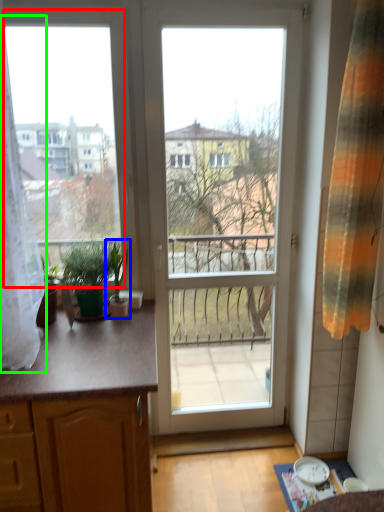
Question: Which object is positioned closest to window screen (highlighted by a red box)? Select from houseplant (highlighted by a blue box) and curtain (highlighted by a green box).

Choices:
 (A) houseplant
 (B) curtain

Answer: (B)